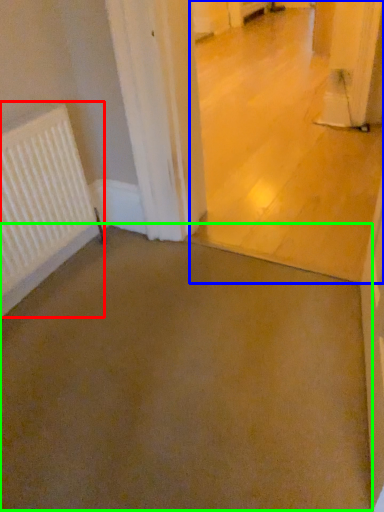
Question: Which object is positioned closest to radiator (highlighted by a red box)? Select from concrete (highlighted by a blue box) and concrete (highlighted by a green box).

Choices:
 (A) concrete
 (B) concrete

Answer: (B)